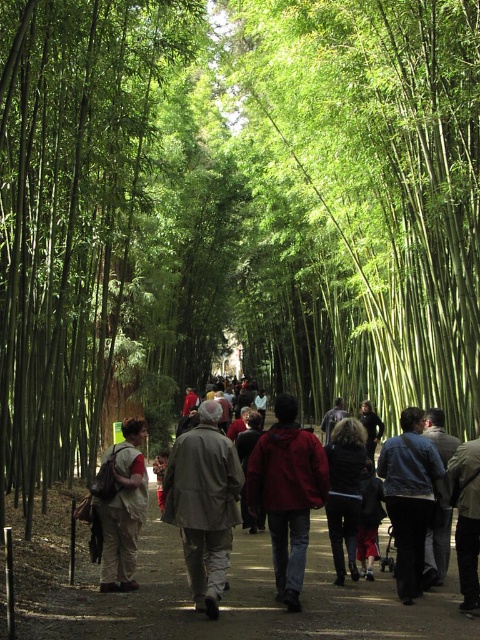
Is green bamboo at left in front of brown dirt path at center?

No.

Is point (57, 236) in front of point (20, 609)?

No, it is not.

Describe the element at coordinates (72, 214) in the screenshot. I see `green bamboo at left` at that location.

Where is `green bamboo at left`? The image size is (480, 640). green bamboo at left is located at coordinates (72, 214).

Is light brown fabric coat at center to the right of khaki pants at center from the viewer's perspective?

Correct, you'll find light brown fabric coat at center to the right of khaki pants at center.

Can you confirm if light brown fabric coat at center is positioned to the left of khaki pants at center?

In fact, light brown fabric coat at center is to the right of khaki pants at center.

Between point (200, 582) and point (108, 472), which one is positioned in front?

Point (200, 582)

This screenshot has width=480, height=640. Identify the location of light brown fabric coat at center. (204, 502).

Can you confirm if dark gray fabric jacket at center is shorter than dark blue jacket at center?

In fact, dark gray fabric jacket at center may be taller than dark blue jacket at center.

Which is in front, point (471, 588) or point (443, 531)?

Point (471, 588) is more forward.

Between point (465, 442) and point (444, 524), which one is positioned behind?

The point (465, 442) is behind.

The width and height of the screenshot is (480, 640). I want to click on dark gray fabric jacket at center, so click(x=467, y=518).